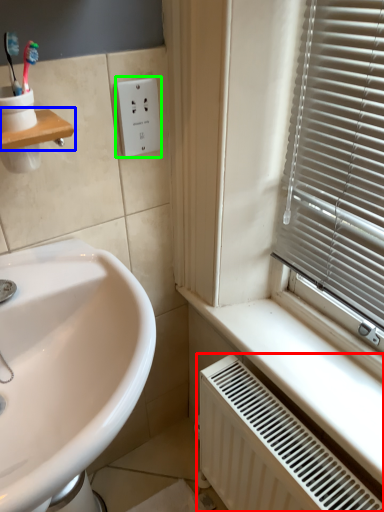
Question: Considering the real-world distances, which object is farthest from radiator (highlighted by a red box)? window sill (highlighted by a blue box) or electric outlet (highlighted by a green box)?

Choices:
 (A) window sill
 (B) electric outlet

Answer: (A)